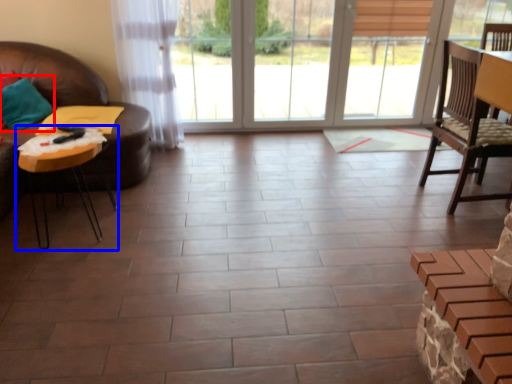
Question: Which point is further to the camera, pillow (highlighted by a red box) or table (highlighted by a blue box)?

Choices:
 (A) pillow
 (B) table

Answer: (A)